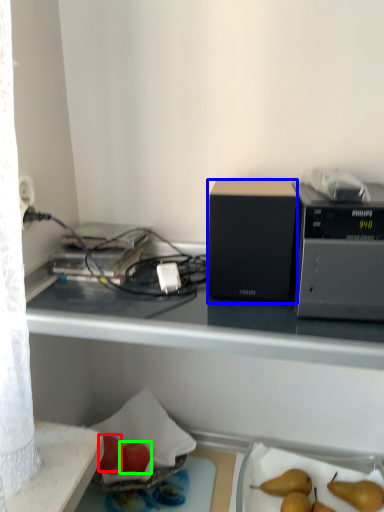
Question: Estimate the real-world distances between objects in this image. Which object is farther from apple (highlighted by a red box), appliance (highlighted by a blue box) or apple (highlighted by a green box)?

Choices:
 (A) appliance
 (B) apple

Answer: (A)